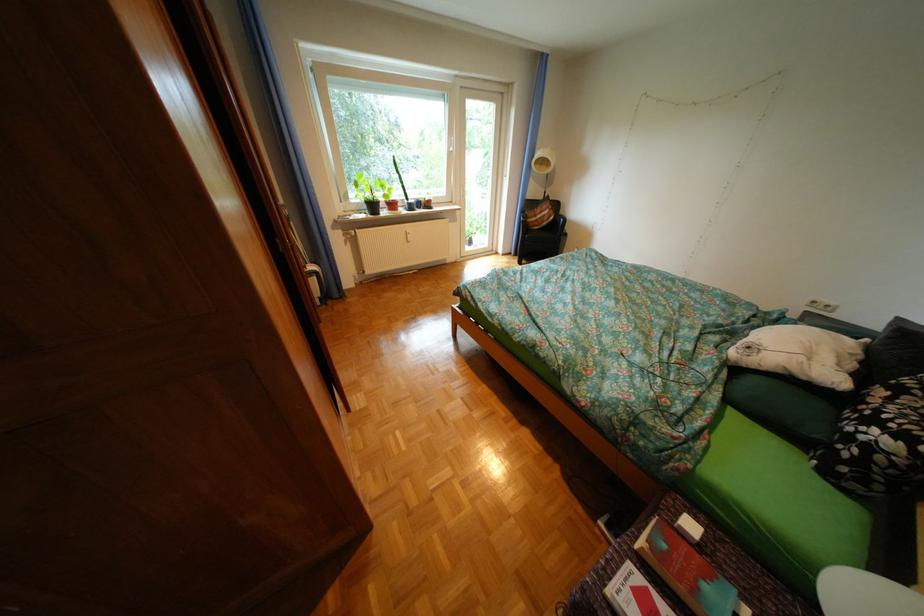
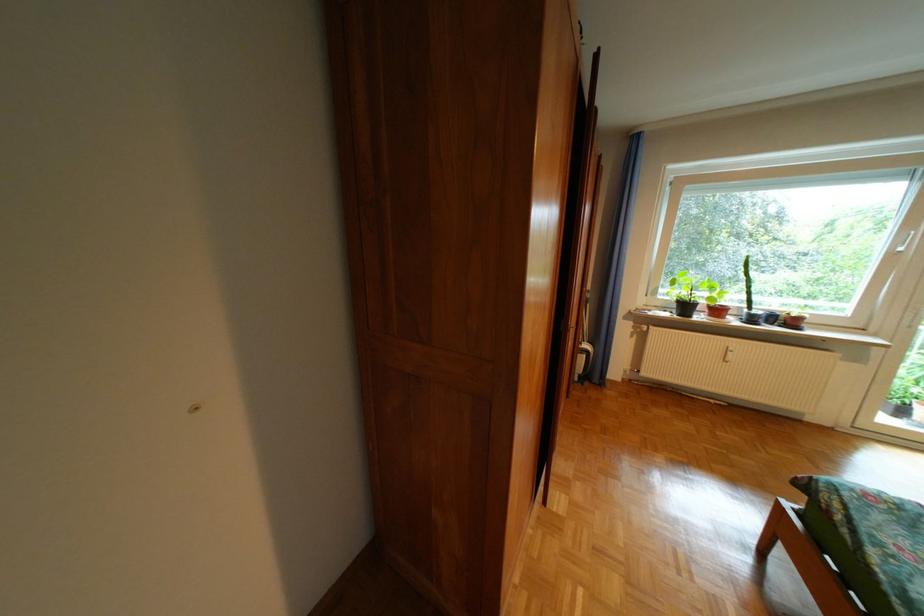
The point at (410,195) is marked in the first image. Where is the corresponding point in the second image?

(747, 300)